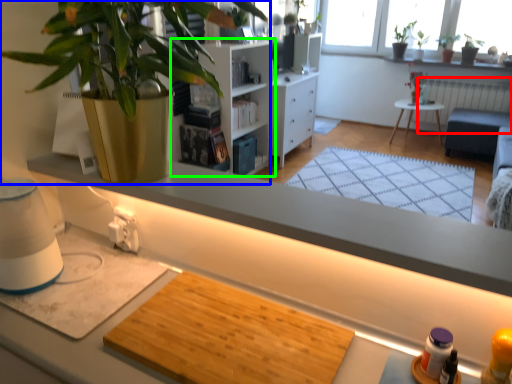
Question: Which object is the closest to the radiator (highlighted by a red box)? Choose among these: houseplant (highlighted by a blue box) or shelf (highlighted by a green box).

Choices:
 (A) houseplant
 (B) shelf

Answer: (B)